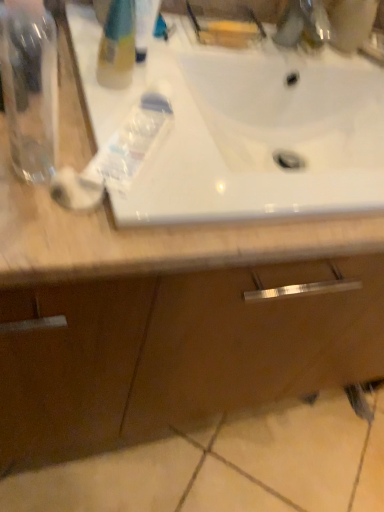
Identify the location of vacant space behind transparent plastic bottle at left. (57, 114).